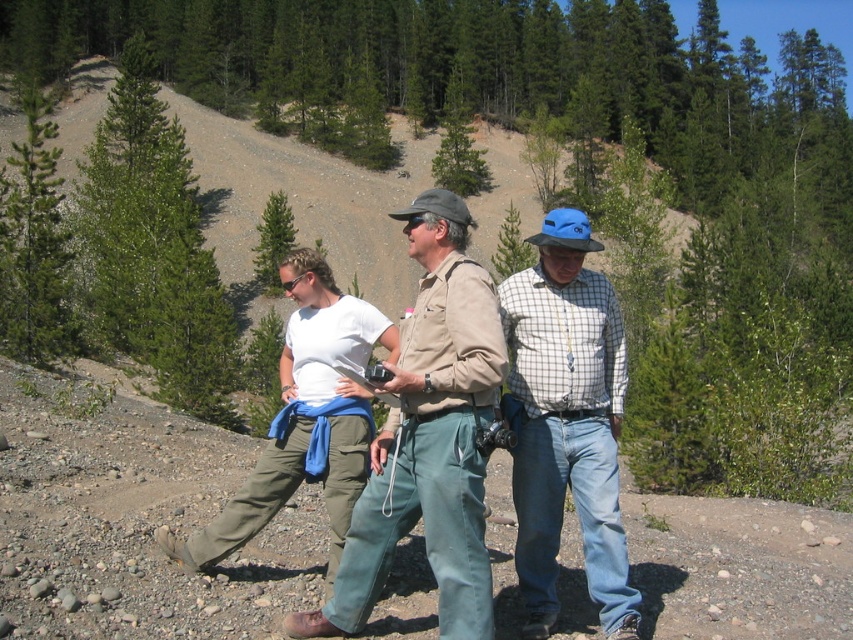
Where is `checkered fabric shirt at center`? This screenshot has height=640, width=853. checkered fabric shirt at center is located at coordinates (566, 422).

Can you confirm if checkered fabric shirt at center is positioned below white cotton shirt at center?

Yes, checkered fabric shirt at center is below white cotton shirt at center.

Between point (577, 358) and point (302, 304), which one is positioned behind?

Point (302, 304)

Where is `checkered fabric shirt at center`? This screenshot has width=853, height=640. checkered fabric shirt at center is located at coordinates (566, 422).

Is khaki cotton pants at center further to camera compared to checkered fabric shirt at center?

Yes, khaki cotton pants at center is behind checkered fabric shirt at center.

Is khaki cotton pants at center smaller than checkered fabric shirt at center?

Yes, khaki cotton pants at center is smaller than checkered fabric shirt at center.

Identify the location of khaki cotton pants at center. This screenshot has width=853, height=640. (428, 438).

Is khaki cotton shirt at center shorter than white cotton shirt at center?

Correct, khaki cotton shirt at center is not as tall as white cotton shirt at center.

The width and height of the screenshot is (853, 640). Find the location of `khaki cotton shirt at center`. khaki cotton shirt at center is located at coordinates pos(428,438).

Between point (494, 336) and point (331, 381), which one is positioned in front?

Point (494, 336)

This screenshot has width=853, height=640. Find the location of `khaki cotton shirt at center`. khaki cotton shirt at center is located at coordinates (428, 438).